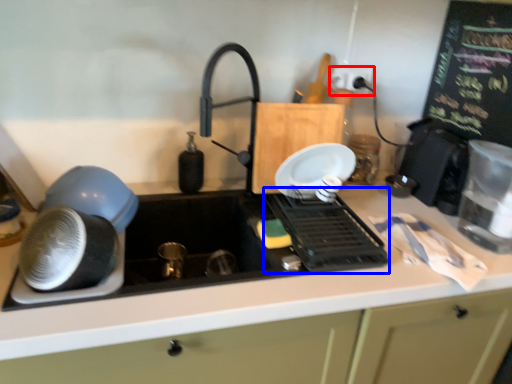
Question: Among these objects, which one is nearest to the camera, electric outlet (highlighted by a red box) or appliance (highlighted by a blue box)?

Choices:
 (A) electric outlet
 (B) appliance

Answer: (B)